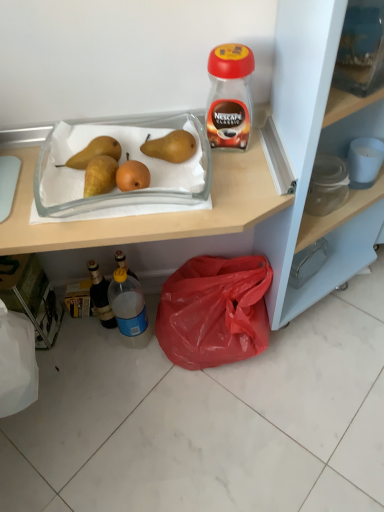
This screenshot has width=384, height=512. Find the location of `free space in front of translucent plastic bottle at lower left, the 2th bottle viewed from the right`. free space in front of translucent plastic bottle at lower left, the 2th bottle viewed from the right is located at coordinates (104, 369).